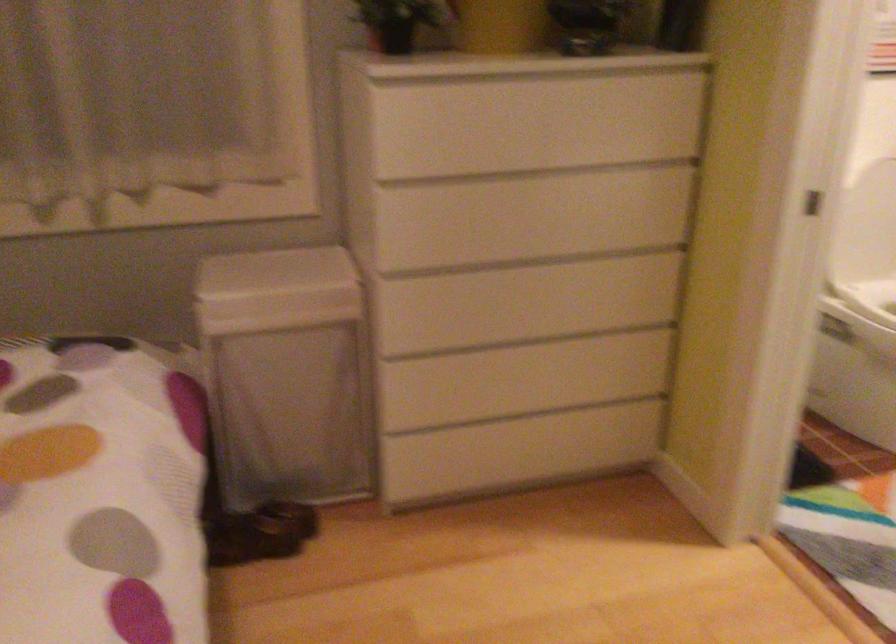
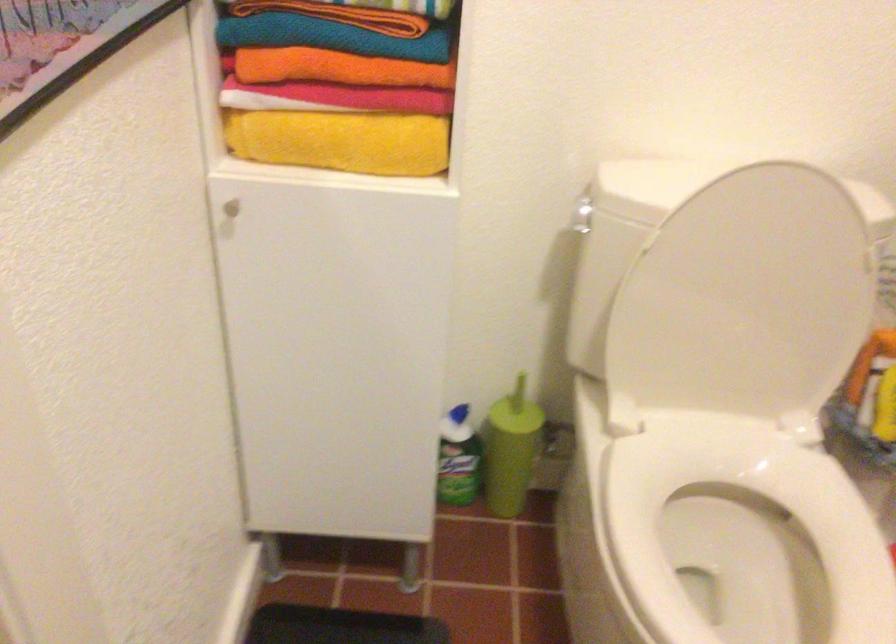
What movement of the cameraman would produce the second image?

The movement direction of the cameraman is right, forward.